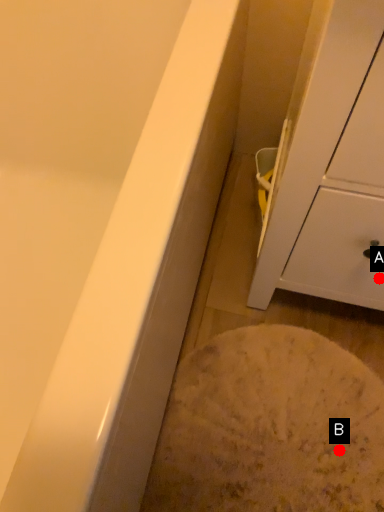
Question: Two points are circled on the image, labeled by A and B beside each circle. Which point is closer to the camera?

Choices:
 (A) A is closer
 (B) B is closer

Answer: (A)